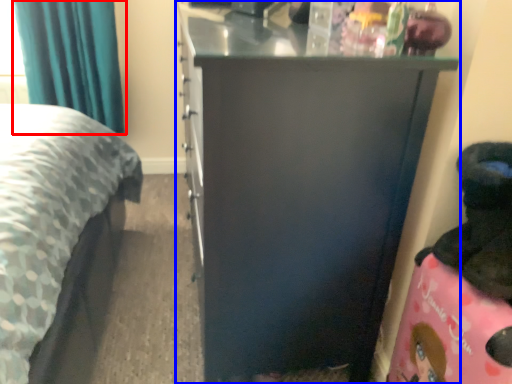
Question: Which object appears farthest to the camera in this image, curtain (highlighted by a red box) or furniture (highlighted by a blue box)?

Choices:
 (A) curtain
 (B) furniture

Answer: (A)